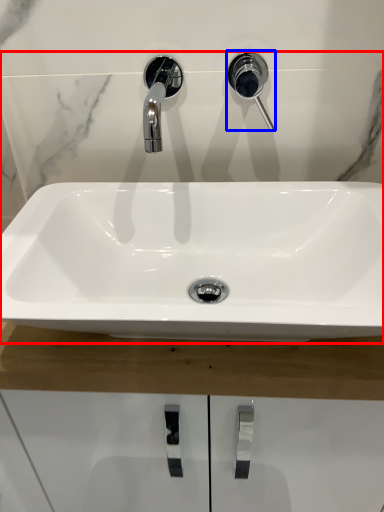
Question: Among these objects, which one is farthest to the camera, sink (highlighted by a red box) or plumbing fixture (highlighted by a blue box)?

Choices:
 (A) sink
 (B) plumbing fixture

Answer: (B)